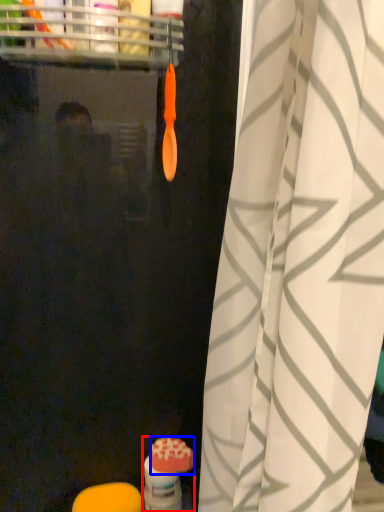
Question: Which of the following is the closest to the observer, toiletry (highlighted by a red box) or soap (highlighted by a blue box)?

Choices:
 (A) toiletry
 (B) soap

Answer: (B)